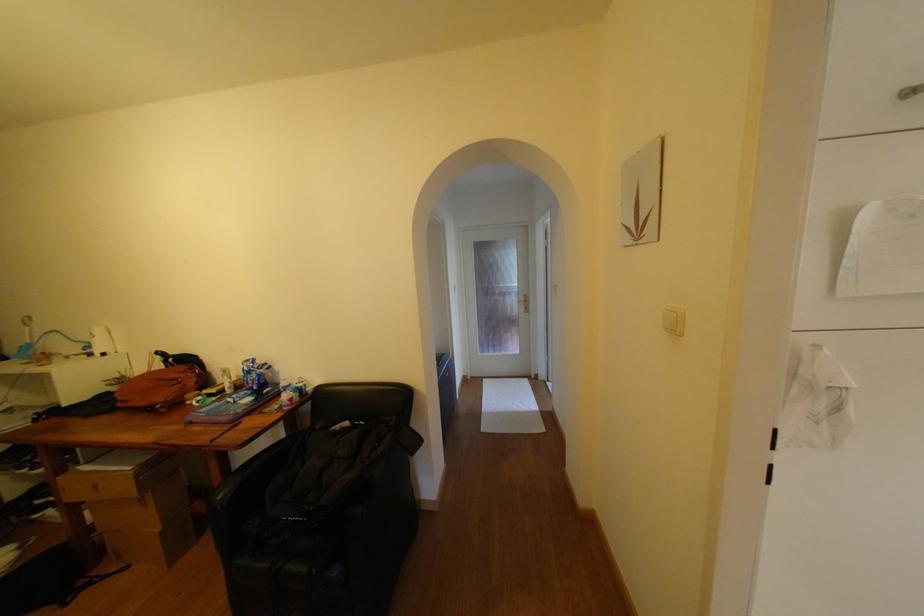
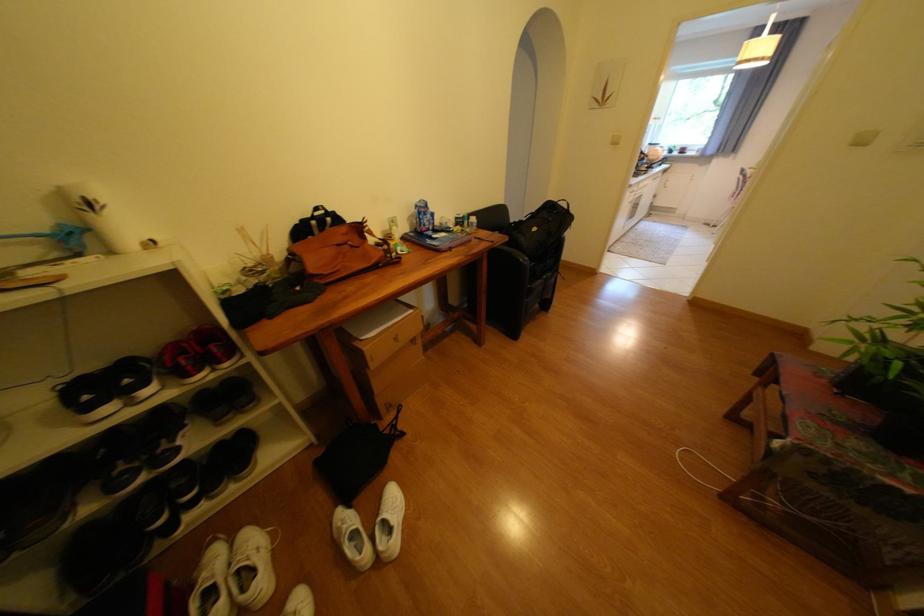
Where in the second image is the point corresponding to (x=190, y=369) from the first image?

(351, 229)